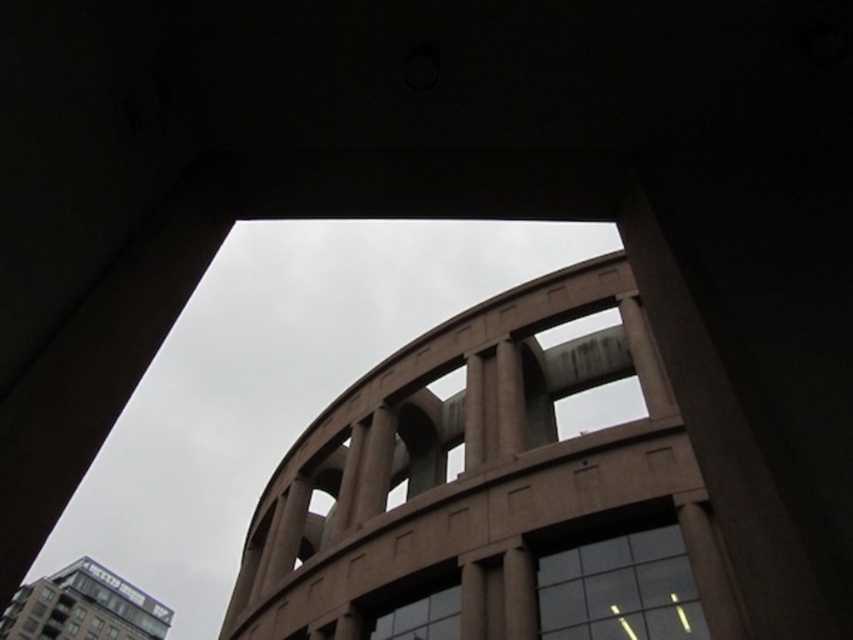
Question: Based on their relative distances, which object is farther from the clear glass window at center?

Choices:
 (A) glassy reflective building at lower left
 (B) transparent glass window at center

Answer: (A)

Question: From the image, what is the correct spatial relationship of glassy reflective building at lower left in relation to clear glass window at center?

Choices:
 (A) above
 (B) below

Answer: (B)

Question: Can you confirm if transparent glass window at center is thinner than clear glass window at center?

Choices:
 (A) no
 (B) yes

Answer: (A)

Question: Can you confirm if transparent glass window at center is positioned to the left of glassy reflective building at lower left?

Choices:
 (A) no
 (B) yes

Answer: (A)

Question: Which point is farther to the camera?

Choices:
 (A) transparent glass window at center
 (B) clear glass window at center
 (C) glassy reflective building at lower left

Answer: (B)

Question: Which point is farther to the camera?

Choices:
 (A) (28, 624)
 (B) (561, 563)

Answer: (A)